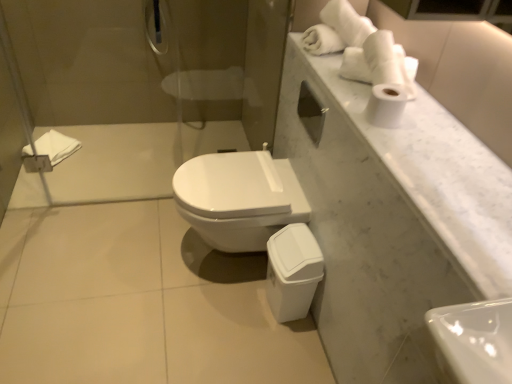
Identify the location of white glossy toilet at center. This screenshot has width=512, height=384. (239, 198).

Image resolution: width=512 pixels, height=384 pixels. I want to click on white marble countertop at upper right, so click(430, 171).

In order to click on glossy metallic showerhead at upper center in this screenshot , I will do `click(155, 27)`.

Which of these two, white soft towel at left or glossy metallic showerhead at upper center, is thinner?

glossy metallic showerhead at upper center is thinner.

Based on the photo, is white soft towel at left oriented towards glossy metallic showerhead at upper center?

No, white soft towel at left is not turned towards glossy metallic showerhead at upper center.

What's the angular difference between white soft towel at left and glossy metallic showerhead at upper center's facing directions?

The facing directions of white soft towel at left and glossy metallic showerhead at upper center are 58 degrees apart.

Is white marble countertop at upper right situated inside white soft towel at left or outside?

The correct answer is: outside.

What's the angular difference between white marble countertop at upper right and white soft towel at left's facing directions?

There is a 146-degree angle between the facing directions of white marble countertop at upper right and white soft towel at left.

Locate an element on the screen. The width and height of the screenshot is (512, 384). bath towel above the white marble countertop at upper right (from the image's perspective) is located at coordinates (56, 146).

In the scene shown: Which of these two, white marble countertop at upper right or white soft towel at left, stands shorter?

white marble countertop at upper right is shorter.

Is white glossy toilet at center next to glossy metallic showerhead at upper center and touching it?

They are not placed beside each other.

Can you tell me how much white glossy toilet at center and glossy metallic showerhead at upper center differ in facing direction?

87.7 degrees.

From the image's perspective, is white glossy toilet at center beneath glossy metallic showerhead at upper center?

Yes, from the image's perspective, white glossy toilet at center is beneath glossy metallic showerhead at upper center.

Is white glossy toilet at center further to the viewer compared to glossy metallic showerhead at upper center?

No, it is in front of glossy metallic showerhead at upper center.

Is the depth of white glossy toilet at center greater than that of white soft towel at left?

No.

Is white glossy toilet at center to the left of white soft towel at left from the viewer's perspective?

No, white glossy toilet at center is not to the left of white soft towel at left.

Measure the distance from white glossy toilet at center to white soft towel at left.

white glossy toilet at center and white soft towel at left are 4.15 feet apart from each other.

Considering the sizes of objects white matte toilet paper at upper right and glossy metallic showerhead at upper center in the image provided, who is shorter, white matte toilet paper at upper right or glossy metallic showerhead at upper center?

With less height is white matte toilet paper at upper right.

Does white matte toilet paper at upper right turn towards glossy metallic showerhead at upper center?

No, white matte toilet paper at upper right is not facing towards glossy metallic showerhead at upper center.

From a real-world perspective, is white matte toilet paper at upper right located higher than glossy metallic showerhead at upper center?

Yes.

Can we say white matte toilet paper at upper right lies outside glossy metallic showerhead at upper center?

white matte toilet paper at upper right lies outside glossy metallic showerhead at upper center's area.

From the image's perspective, is white marble countertop at upper right positioned above or below glossy metallic showerhead at upper center?

Based on their image positions, white marble countertop at upper right is located beneath glossy metallic showerhead at upper center.

In the scene shown: Who is bigger, white marble countertop at upper right or glossy metallic showerhead at upper center?

white marble countertop at upper right is bigger.

Considering the sizes of objects white marble countertop at upper right and glossy metallic showerhead at upper center in the image provided, who is thinner, white marble countertop at upper right or glossy metallic showerhead at upper center?

glossy metallic showerhead at upper center.

Choose the correct answer: Is white marble countertop at upper right inside glossy metallic showerhead at upper center or outside it?

white marble countertop at upper right is outside glossy metallic showerhead at upper center.

Looking at this image, can you tell me how much white glossy toilet at center and white marble countertop at upper right differ in facing direction?

There is a 0.807-degree angle between the facing directions of white glossy toilet at center and white marble countertop at upper right.

From the image's perspective, which is above, white glossy toilet at center or white marble countertop at upper right?

From the image's view, white marble countertop at upper right is above.

The width and height of the screenshot is (512, 384). What are the coordinates of `counter top that is above the white glossy toilet at center (from a real-world perspective)` in the screenshot? It's located at (430, 171).

Who is taller, white glossy toilet at center or white marble countertop at upper right?

white glossy toilet at center is taller.

In the image, there is a glossy metallic showerhead at upper center. Where is `bath towel below it (from a real-world perspective)`? The image size is (512, 384). bath towel below it (from a real-world perspective) is located at coordinates (56, 146).

Find the location of a particular element. bath towel behind the white marble countertop at upper right is located at coordinates (56, 146).

From the image, which object appears to be farther from white soft towel at left, white glossy toilet at center or white matte toilet paper at upper right?

Based on the image, white matte toilet paper at upper right appears to be further to white soft towel at left.

When comparing their distances from glossy metallic showerhead at upper center, does white soft towel at left or white matte toilet paper at upper right seem further?

The object further to glossy metallic showerhead at upper center is white matte toilet paper at upper right.

Considering their positions, is white soft towel at left positioned further to white matte toilet paper at upper right than glossy metallic showerhead at upper center?

white soft towel at left lies further to white matte toilet paper at upper right than the other object.

From the picture: Which object lies further to the anchor point glossy metallic showerhead at upper center, white matte toilet paper at upper right or white glossy toilet at center?

white matte toilet paper at upper right is further to glossy metallic showerhead at upper center.

Based on their spatial positions, is white matte toilet paper at upper right or white soft towel at left further from white marble countertop at upper right?

white soft towel at left is positioned further to the anchor white marble countertop at upper right.

Looking at the image, which one is located closer to glossy metallic showerhead at upper center, white glossy toilet at center or white soft towel at left?

Among the two, white soft towel at left is located nearer to glossy metallic showerhead at upper center.

From the image, which object appears to be farther from white glossy toilet at center, white marble countertop at upper right or white soft towel at left?

white soft towel at left lies further to white glossy toilet at center than the other object.

Estimate the real-world distances between objects in this image. Which object is closer to white matte toilet paper at upper right, glossy metallic showerhead at upper center or white marble countertop at upper right?

white marble countertop at upper right is positioned closer to the anchor white matte toilet paper at upper right.

Find the location of a particular element. The width and height of the screenshot is (512, 384). shower between white soft towel at left and white matte toilet paper at upper right from left to right is located at coordinates (155, 27).

Locate an element on the screen. Image resolution: width=512 pixels, height=384 pixels. toilet between white soft towel at left and white marble countertop at upper right from left to right is located at coordinates (239, 198).

This screenshot has width=512, height=384. In order to click on toilet paper positioned between white marble countertop at upper right and white glossy toilet at center from near to far in this screenshot , I will do (x=386, y=105).

I want to click on toilet located between white marble countertop at upper right and glossy metallic showerhead at upper center in the depth direction, so click(239, 198).